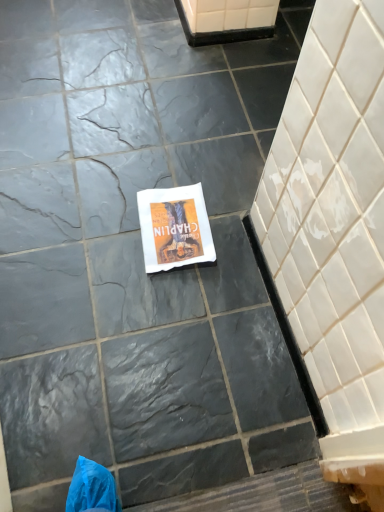
This screenshot has height=512, width=384. I want to click on free region under white paper towel at center (from a real-world perspective), so click(170, 222).